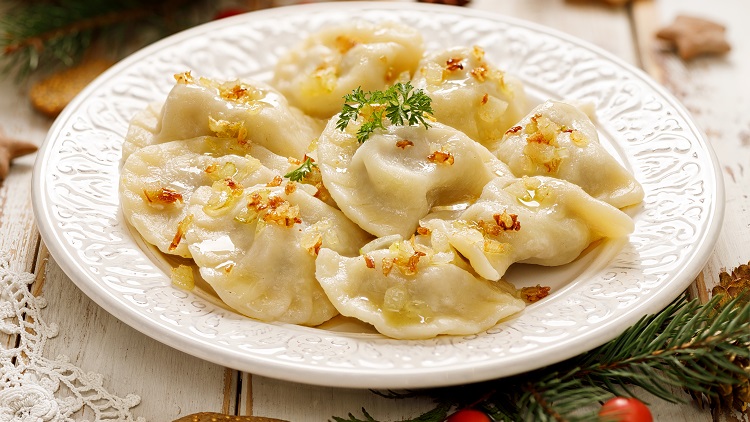
The image size is (750, 422). Find the location of `decorative plate edge`. decorative plate edge is located at coordinates (241, 41), (506, 46), (680, 173), (628, 291), (442, 353), (202, 318), (85, 184).